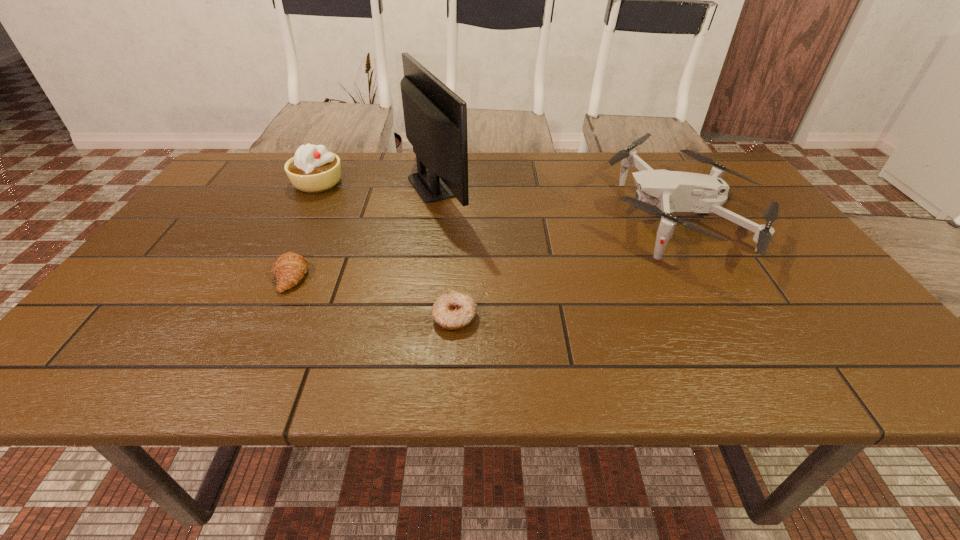
You are a GUI agent. You are given a task and a screenshot of the screen. Output one action in this format:
    pyautogui.click(x=<x>, y=<y>)
    Task: Click on the free space between the tallest object and the nearest object
    The height and width of the screenshot is (540, 960).
    Given the screenshot: What is the action you would take?
    pyautogui.click(x=446, y=251)

The image size is (960, 540). I want to click on free area in between the drone and the doughnut, so (567, 266).

I want to click on unoccupied position between the whipped cream and the fourth tallest object, so click(x=304, y=229).

Identify the location of free space that is in between the whipped cream and the crescent roll. This screenshot has width=960, height=540. (304, 229).

Choose which object is the fourth nearest neighbor to the tallest object. Please provide its 2D coordinates. Your answer should be formatted as a tuple, i.e. [(x, y)], where the tuple contains the x and y coordinates of a point satisfying the conditions above.

[(660, 192)]

What are the coordinates of `the second closest object to the computer monitor` in the screenshot? It's located at (289, 268).